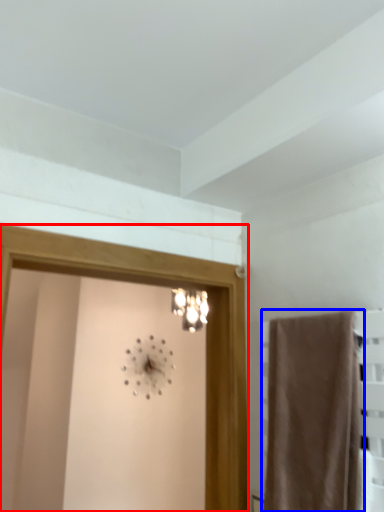
Question: Which point is closer to the camera, screen door (highlighted by a red box) or curtain (highlighted by a blue box)?

Choices:
 (A) screen door
 (B) curtain

Answer: (B)